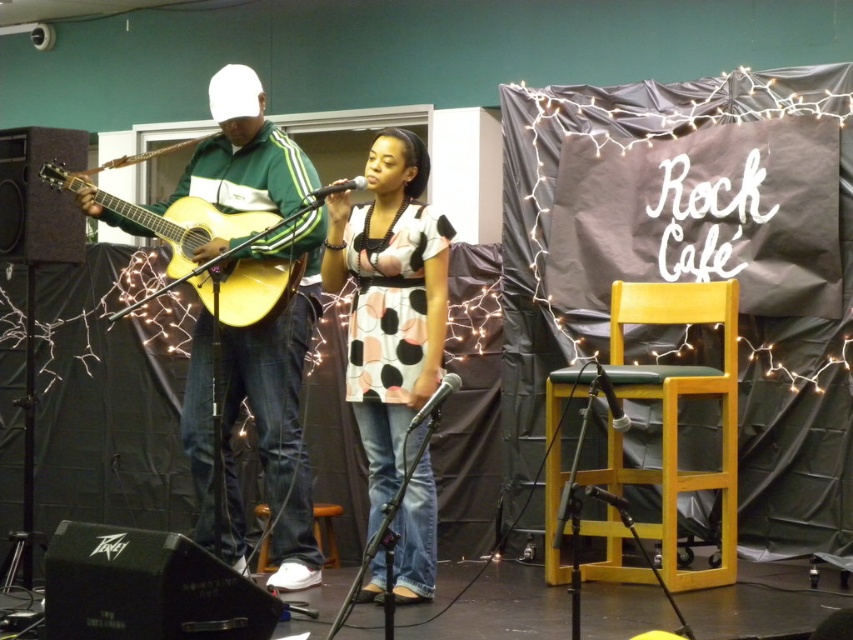
Is the position of polka dot fabric dress at center less distant than that of acoustic wood guitar at left?

That is False.

Can you confirm if polka dot fabric dress at center is bigger than acoustic wood guitar at left?

Actually, polka dot fabric dress at center might be smaller than acoustic wood guitar at left.

Find the location of `polka dot fabric dress at center`. polka dot fabric dress at center is located at coordinates (389, 301).

I want to click on polka dot fabric dress at center, so click(389, 301).

What do you see at coordinates (274, 412) in the screenshot? I see `matte green jacket at center` at bounding box center [274, 412].

Can you confirm if matte green jacket at center is smaller than polka dot fabric dress at center?

Incorrect, matte green jacket at center is not smaller in size than polka dot fabric dress at center.

Between point (231, 552) and point (427, 275), which one is positioned behind?

The point (231, 552) is behind.

Locate an element on the screen. This screenshot has height=640, width=853. matte green jacket at center is located at coordinates (274, 412).

Is matte green jacket at center thinner than acoustic wood guitar at left?

Yes, matte green jacket at center is thinner than acoustic wood guitar at left.

Can you confirm if matte green jacket at center is wider than acoustic wood guitar at left?

In fact, matte green jacket at center might be narrower than acoustic wood guitar at left.

Who is more forward, (x=256, y=147) or (x=264, y=296)?

Point (x=264, y=296) is more forward.

You are a GUI agent. You are given a task and a screenshot of the screen. Output one action in this format:
    pyautogui.click(x=<x>, y=<y>)
    Task: Click on the matte green jacket at center
    The height and width of the screenshot is (640, 853).
    Given the screenshot: What is the action you would take?
    pyautogui.click(x=274, y=412)